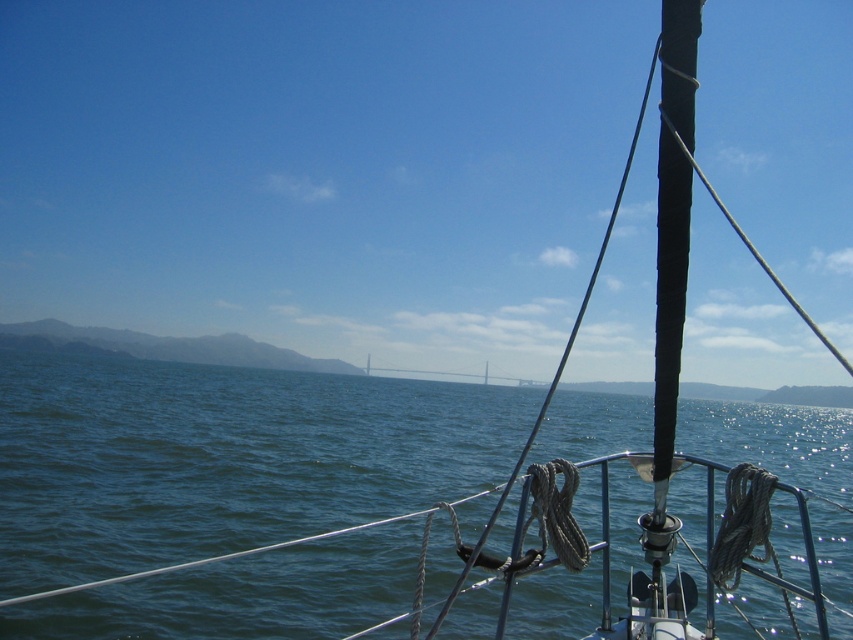
Question: Which of the following is the closest to the observer?

Choices:
 (A) gray metallic bridge at center
 (B) blue water at center

Answer: (B)

Question: Does blue water at center appear over gray metallic bridge at center?

Choices:
 (A) yes
 (B) no

Answer: (A)

Question: Is blue water at center positioned before gray metallic bridge at center?

Choices:
 (A) yes
 (B) no

Answer: (A)

Question: Which point is closer to the camera taking this photo?

Choices:
 (A) (746, 609)
 (B) (535, 384)

Answer: (A)

Question: Which object appears closest to the camera in this image?

Choices:
 (A) blue water at center
 (B) gray metallic bridge at center

Answer: (A)

Question: Can you confirm if blue water at center is positioned below gray metallic bridge at center?

Choices:
 (A) yes
 (B) no

Answer: (B)